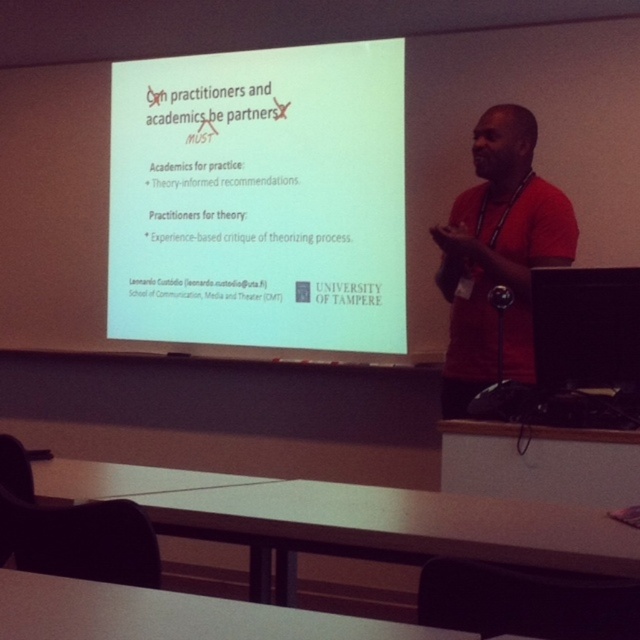
You are standing in the lecture hall and want to adjust the projection on the white matte projector screen at upper center. If your arm reaches 2.5 meters, can you comfortably reach the projector controls located 11.03 feet away from you?

The white matte projector screen at upper center is 11.03 feet away from the viewer. Converting feet to meters, 11.03 feet is approximately 3.36 meters. Since your arm reaches 2.5 meters, you cannot comfortably reach the projector controls located 3.36 meters away.